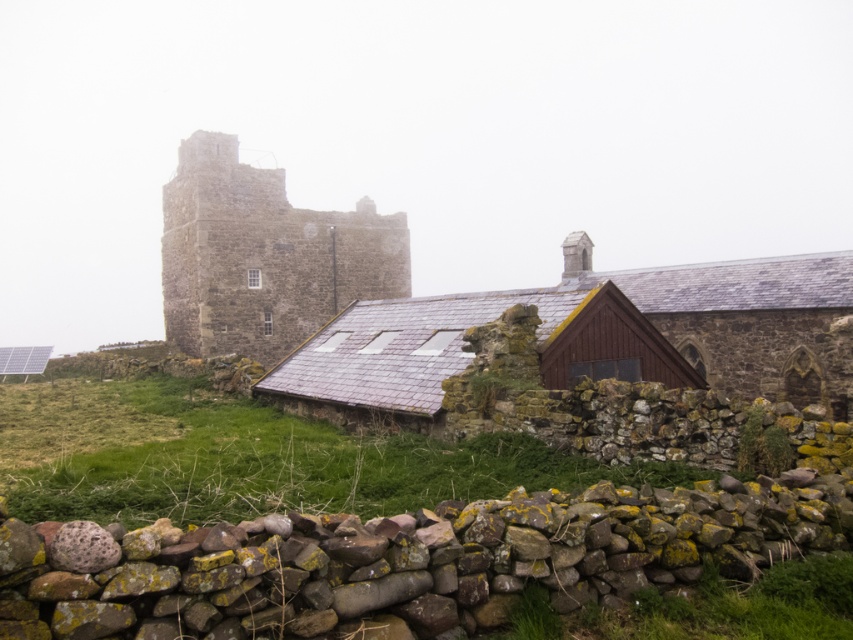
Is point (688, 376) positioned after point (113, 497)?

That is True.

Between point (401, 410) and point (422, 476), which one is positioned in front?

Point (422, 476) is more forward.

Who is more forward, [248,170] or [479,470]?

Point [479,470] is in front.

This screenshot has height=640, width=853. Find the location of `stone tower at center`. stone tower at center is located at coordinates (471, 305).

Based on the photo, who is higher up, stone tower at upper left or green mossy grass at lower center?

Positioned higher is stone tower at upper left.

Is stone tower at upper left shorter than green mossy grass at lower center?

No, stone tower at upper left is not shorter than green mossy grass at lower center.

Who is more forward, (213, 330) or (691, 600)?

Point (691, 600) is more forward.

The height and width of the screenshot is (640, 853). Find the location of `stone tower at upper left`. stone tower at upper left is located at coordinates (263, 257).

Does point (465, 321) come farther from viewer compared to point (824, 582)?

Yes, point (465, 321) is behind point (824, 582).

You are a GUI agent. You are given a task and a screenshot of the screen. Output one action in this format:
    pyautogui.click(x=<x>, y=<y>)
    Task: Click on the stone tower at center
    
    Given the screenshot: What is the action you would take?
    pyautogui.click(x=471, y=305)

Is point (241, 202) behind point (734, 609)?

Yes, point (241, 202) is behind point (734, 609).

Locate an element on the screen. The image size is (853, 640). stone tower at center is located at coordinates (471, 305).